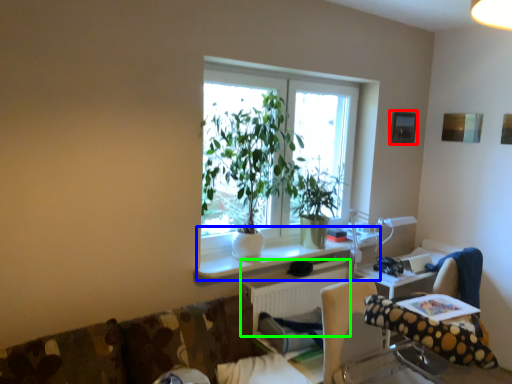
Question: Which object is the closest to the picture frame (highlighted by a red box)? Choose among these: computer desk (highlighted by a blue box) or radiator (highlighted by a green box).

Choices:
 (A) computer desk
 (B) radiator

Answer: (A)